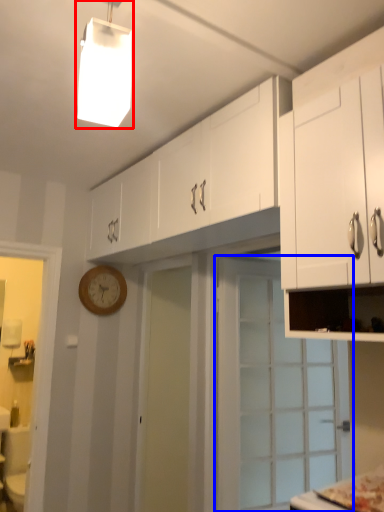
Question: Which object appears closest to the camera in this image, light fixture (highlighted by a red box) or door (highlighted by a blue box)?

Choices:
 (A) light fixture
 (B) door

Answer: (A)